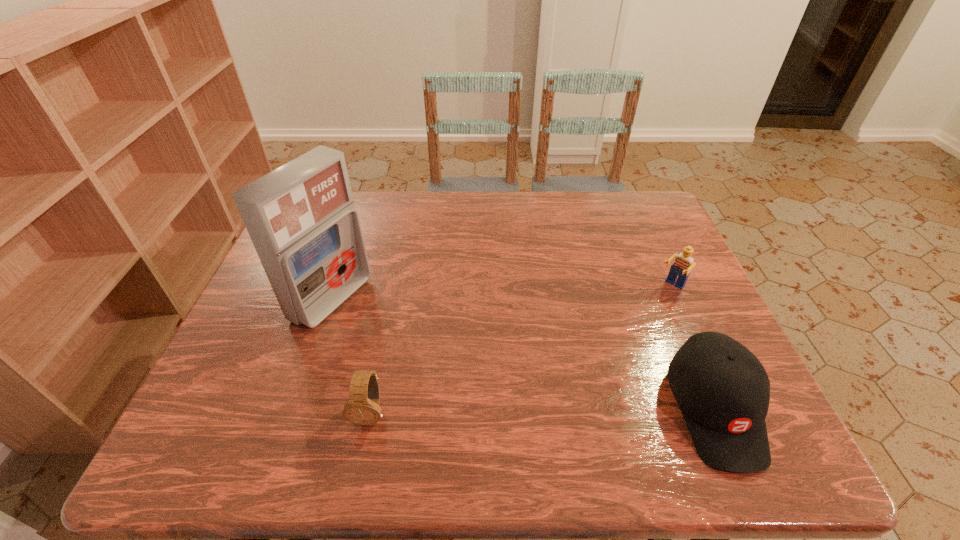
Point out which object is positioned as the third nearest to the tallest object. Please provide its 2D coordinates. Your answer should be formatted as a tuple, i.e. [(x, y)], where the tuple contains the x and y coordinates of a point satisfying the conditions above.

[(683, 264)]